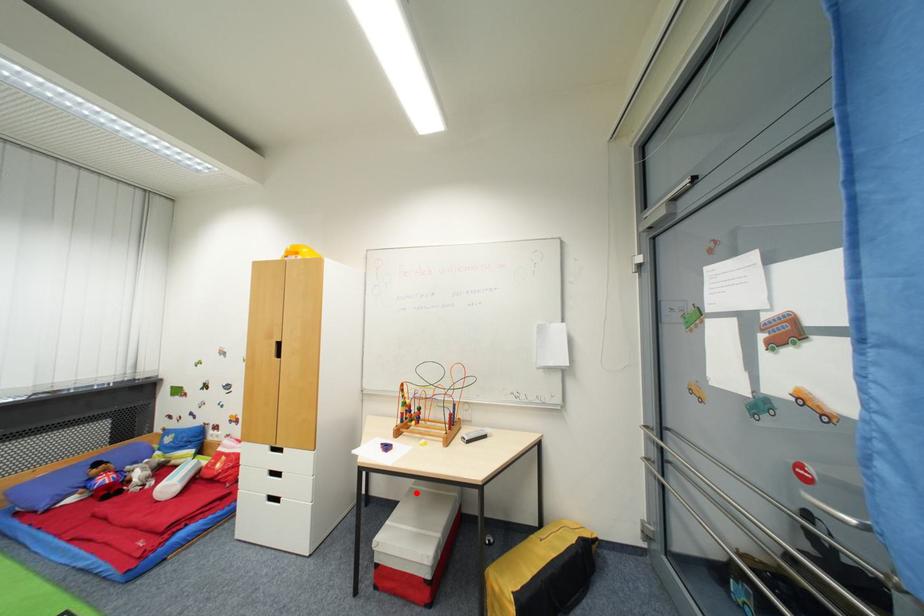
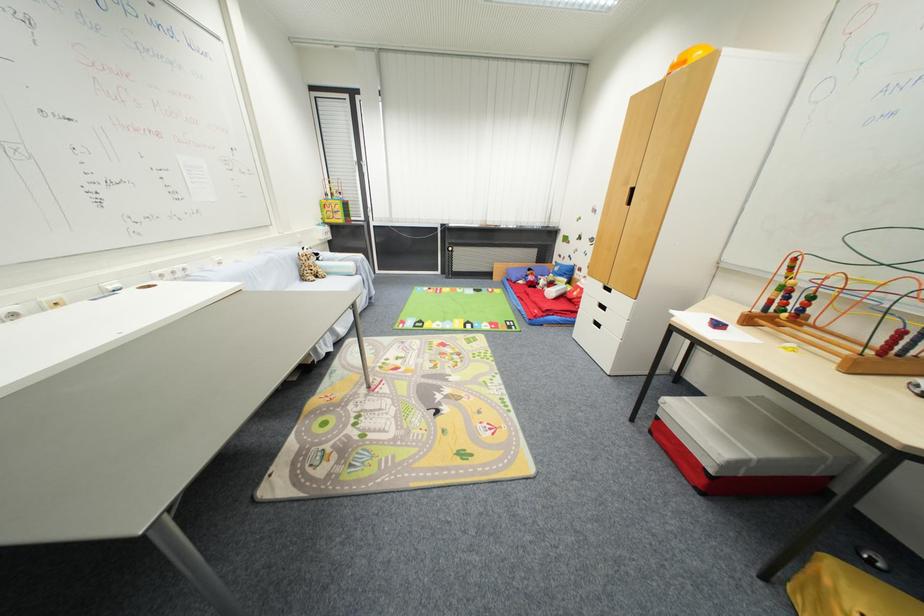
Question: I am providing you with two images of the same scene from different viewpoints. In image1, a red point is highlighted. Considering the same 3D point in image2, which of the following is correct?

Choices:
 (A) It is closer
 (B) It is farther

Answer: (A)